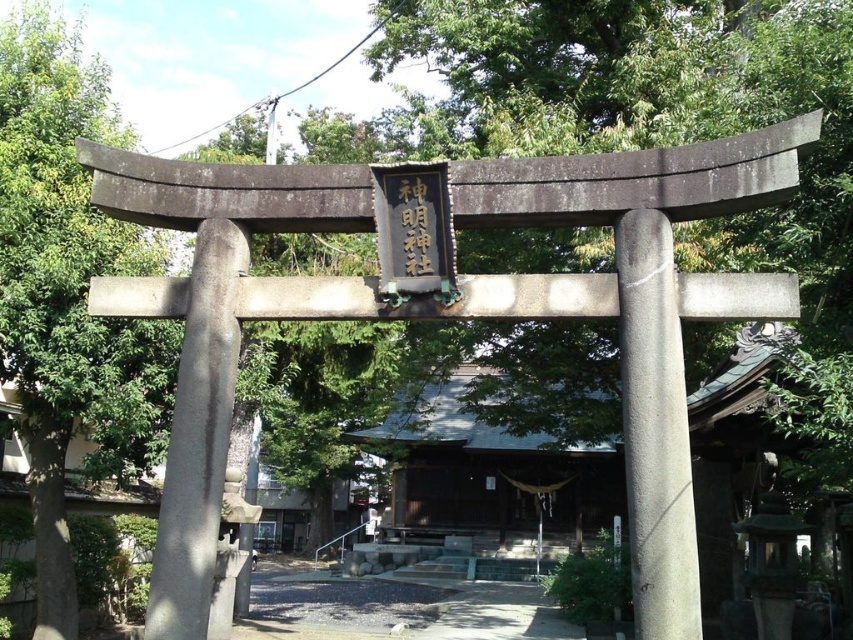
Is gray stone pillar at center taller than gray concrete pillar at left?

No.

Does gray stone pillar at center have a larger size compared to gray concrete pillar at left?

No.

Who is more forward, (650, 253) or (201, 371)?

Point (650, 253) is more forward.

Find the location of a particular element. This screenshot has width=853, height=640. gray stone pillar at center is located at coordinates (654, 432).

Is gray stone pillar at center positioned behind black wood sign at center?

No, gray stone pillar at center is closer to the viewer.

Does point (643, 556) come closer to viewer compared to point (410, 228)?

That is True.

Locate an element on the screen. This screenshot has width=853, height=640. gray stone pillar at center is located at coordinates (654, 432).

Does gray concrete pillar at left have a greater height compared to black wood sign at center?

Yes, gray concrete pillar at left is taller than black wood sign at center.

Does gray concrete pillar at left have a lesser width compared to black wood sign at center?

In fact, gray concrete pillar at left might be wider than black wood sign at center.

Is point (228, 412) closer to camera compared to point (408, 262)?

That is False.

Locate an element on the screen. This screenshot has width=853, height=640. gray concrete pillar at left is located at coordinates (198, 436).